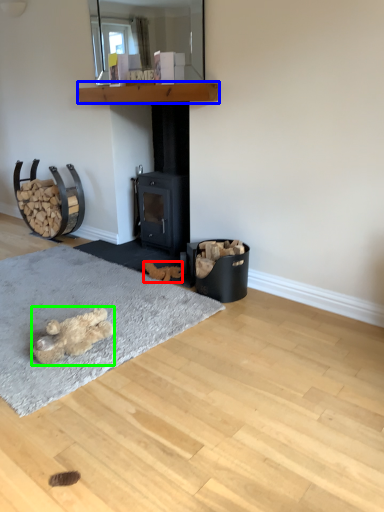
Question: Which object is positioned farthest from animal (highlighted by a red box)? Select from shelf (highlighted by a blue box) and animal (highlighted by a green box).

Choices:
 (A) shelf
 (B) animal

Answer: (A)